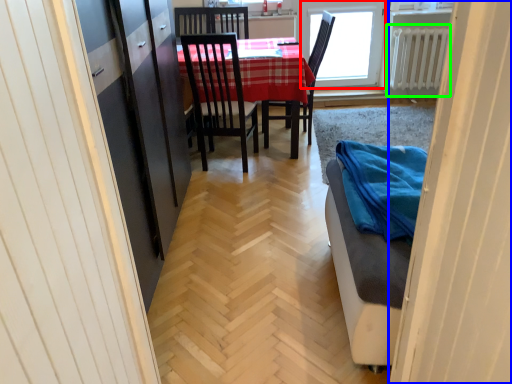
Question: Estimate the real-world distances between objects in this image. Which object is closer to window (highlighted by a red box), door (highlighted by a blue box) or radiator (highlighted by a green box)?

Choices:
 (A) door
 (B) radiator

Answer: (B)